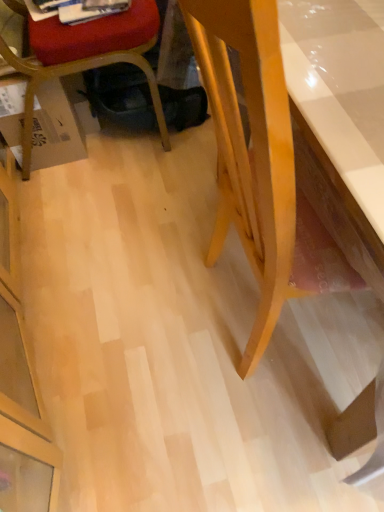
Question: Is point (100, 6) positioned closer to the camera than point (41, 105)?

Choices:
 (A) closer
 (B) farther

Answer: (A)

Question: From the image's perspective, is white glossy magazine at upper left located above or below brown cardboard box at lower left?

Choices:
 (A) below
 (B) above

Answer: (B)

Question: Which object is the farthest from the brown cardboard box at lower left?

Choices:
 (A) matte plastic chair at lower left
 (B) white glossy magazine at upper left
 (C) light wood desk at right

Answer: (C)

Question: Which object is the farthest from the brown cardboard box at lower left?

Choices:
 (A) matte plastic chair at lower left
 (B) light wood desk at right
 (C) white glossy magazine at upper left

Answer: (B)